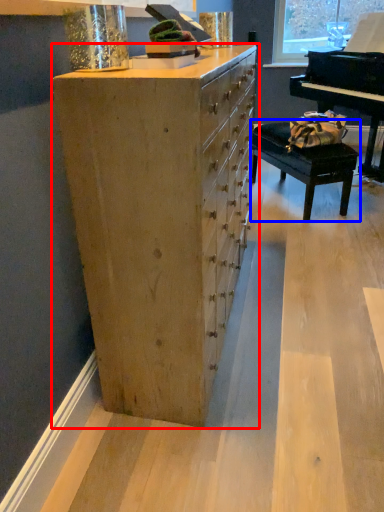
Question: Which point is closer to the camera, chest of drawers (highlighted by a red box) or table (highlighted by a blue box)?

Choices:
 (A) chest of drawers
 (B) table

Answer: (A)